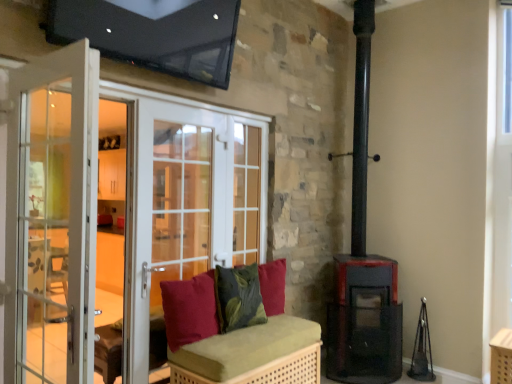
Locate an element on the screen. Image resolution: width=512 pixels, height=384 pixels. white glass screen door at center, positioned as the 1th screen door in back-to-front order is located at coordinates (192, 204).

What do you see at coordinates (52, 218) in the screenshot?
I see `white glass screen door at left, the first screen door in the front-to-back sequence` at bounding box center [52, 218].

This screenshot has width=512, height=384. In order to click on matte black stove at lower right in this screenshot , I will do `click(364, 322)`.

Relative to white glass screen door at left, which is counted as the 2th screen door, starting from the back, is green textured cushion at center, which is the second pillow from front to back, in front or behind?

green textured cushion at center, which is the second pillow from front to back, is positioned farther from the viewer than white glass screen door at left, which is counted as the 2th screen door, starting from the back.

Does green textured cushion at center, which is the second pillow from front to back, have a lesser height compared to white glass screen door at left, the first screen door in the front-to-back sequence?

Yes, green textured cushion at center, which is the second pillow from front to back, is shorter than white glass screen door at left, the first screen door in the front-to-back sequence.

Can you confirm if green textured cushion at center, which is the second pillow from front to back, is smaller than white glass screen door at left, the first screen door in the front-to-back sequence?

A: Yes, green textured cushion at center, which is the second pillow from front to back, is smaller than white glass screen door at left, the first screen door in the front-to-back sequence.

From the image's perspective, is velvet red cushion at center, the first pillow positioned from the front, located above green woven bench at center?

Indeed, from the image's perspective, velvet red cushion at center, the first pillow positioned from the front, is shown above green woven bench at center.

Image resolution: width=512 pixels, height=384 pixels. In the image, there is a velvet red cushion at center, the first pillow positioned from the front. Identify the location of furniture below it (from a real-world perspective). (231, 332).

Would you say velvet red cushion at center, the first pillow positioned from the front, is outside green woven bench at center?

Yes, velvet red cushion at center, the first pillow positioned from the front, is outside of green woven bench at center.

Is velvet red cushion at center, which ranks as the 3th pillow in back-to-front order, in contact with green woven bench at center?

velvet red cushion at center, which ranks as the 3th pillow in back-to-front order, and green woven bench at center are clearly separated.

Identify the location of stove lying above the green woven bench at center (from the image's perspective). This screenshot has height=384, width=512. (364, 322).

Which of these two, green woven bench at center or matte black stove at lower right, stands taller?

Standing taller between the two is matte black stove at lower right.

Looking at this image, who is bigger, green woven bench at center or matte black stove at lower right?

With larger size is green woven bench at center.

From the image's perspective, which one is positioned higher, green woven bench at center or matte black stove at lower right?

matte black stove at lower right appears higher in the image.

How different are the orientations of green textured cushion at center, which ranks as the second pillow in back-to-front order, and velvet red cushion at center, which ranks as the 3th pillow in back-to-front order, in degrees?

0.00187 degrees separate the facing orientations of green textured cushion at center, which ranks as the second pillow in back-to-front order, and velvet red cushion at center, which ranks as the 3th pillow in back-to-front order.

Considering the positions of point (256, 273) and point (209, 316), is point (256, 273) closer or farther from the camera than point (209, 316)?

Point (256, 273) is farther from the camera than point (209, 316).

Can you confirm if green textured cushion at center, which is the second pillow from front to back, is positioned to the right of velvet red cushion at center, the first pillow positioned from the front?

Indeed, green textured cushion at center, which is the second pillow from front to back, is positioned on the right side of velvet red cushion at center, the first pillow positioned from the front.

Considering the relative sizes of green textured cushion at center, which ranks as the second pillow in back-to-front order, and velvet red cushion at center, which ranks as the 3th pillow in back-to-front order, in the image provided, is green textured cushion at center, which ranks as the second pillow in back-to-front order, taller than velvet red cushion at center, which ranks as the 3th pillow in back-to-front order,?

No, green textured cushion at center, which ranks as the second pillow in back-to-front order, is not taller than velvet red cushion at center, which ranks as the 3th pillow in back-to-front order.

Identify the location of screen door that appears below the white glass screen door at left, which is counted as the 2th screen door, starting from the back (from a real-world perspective). Image resolution: width=512 pixels, height=384 pixels. pos(192,204).

Would you say white glass screen door at left, which is counted as the 2th screen door, starting from the back, is outside white glass screen door at center, positioned as the 1th screen door in back-to-front order?

Absolutely, white glass screen door at left, which is counted as the 2th screen door, starting from the back, is external to white glass screen door at center, positioned as the 1th screen door in back-to-front order.

How much distance is there between white glass screen door at left, which is counted as the 2th screen door, starting from the back, and white glass screen door at center, positioned as the 1th screen door in back-to-front order?

A distance of 98.73 centimeters exists between white glass screen door at left, which is counted as the 2th screen door, starting from the back, and white glass screen door at center, positioned as the 1th screen door in back-to-front order.

Is white glass screen door at center, positioned as the 1th screen door in back-to-front order, not near green textured cushion at center, which is the second pillow from front to back?

No, there isn't a large distance between white glass screen door at center, positioned as the 1th screen door in back-to-front order, and green textured cushion at center, which is the second pillow from front to back.

Which of these two, white glass screen door at center, positioned as the 1th screen door in back-to-front order, or green textured cushion at center, which is the second pillow from front to back, is bigger?

white glass screen door at center, positioned as the 1th screen door in back-to-front order.

Is white glass screen door at center, which ranks as the second screen door in front-to-back order, facing away from green textured cushion at center, which ranks as the second pillow in back-to-front order?

white glass screen door at center, which ranks as the second screen door in front-to-back order, does not have its back to green textured cushion at center, which ranks as the second pillow in back-to-front order.

Relative to green textured cushion at center, which is the second pillow from front to back, is white glass screen door at center, which ranks as the second screen door in front-to-back order, in front or behind?

Clearly, white glass screen door at center, which ranks as the second screen door in front-to-back order, is in front of green textured cushion at center, which is the second pillow from front to back.

Is matte black stove at lower right with white glass screen door at left, which is counted as the 2th screen door, starting from the back?

They are not placed beside each other.

Is matte black stove at lower right closer to the viewer compared to white glass screen door at left, which is counted as the 2th screen door, starting from the back?

No, it is behind white glass screen door at left, which is counted as the 2th screen door, starting from the back.

Is matte black stove at lower right wider or thinner than white glass screen door at left, the first screen door in the front-to-back sequence?

Clearly, matte black stove at lower right has more width compared to white glass screen door at left, the first screen door in the front-to-back sequence.

Between matte black stove at lower right and white glass screen door at left, the first screen door in the front-to-back sequence, which one appears on the left side from the viewer's perspective?

white glass screen door at left, the first screen door in the front-to-back sequence.

Find the location of a particular element. This screenshot has height=384, width=512. pillow that is the 2nd one when counting backward from the white glass screen door at left, the first screen door in the front-to-back sequence is located at coordinates (238, 297).

Find the location of a particular element. The width and height of the screenshot is (512, 384). furniture below the velvet red cushion at center, which ranks as the 3th pillow in back-to-front order (from the image's perspective) is located at coordinates (231, 332).

Based on their spatial positions, is green textured cushion at center, which ranks as the second pillow in back-to-front order, or velvet red cushion at center, positioned as the third pillow in front-to-back order, closer to velvet red cushion at center, the first pillow positioned from the front?

green textured cushion at center, which ranks as the second pillow in back-to-front order, is positioned closer to the anchor velvet red cushion at center, the first pillow positioned from the front.

Considering their positions, is velvet red cushion at center, the first pillow positioned from the front, positioned closer to green woven bench at center than matte black stove at lower right?

The object closer to green woven bench at center is velvet red cushion at center, the first pillow positioned from the front.

When comparing their distances from green woven bench at center, does white glass screen door at center, positioned as the 1th screen door in back-to-front order, or velvet red cushion at center, the first pillow positioned from the front, seem further?

Based on the image, white glass screen door at center, positioned as the 1th screen door in back-to-front order, appears to be further to green woven bench at center.

Based on their spatial positions, is green textured cushion at center, which ranks as the second pillow in back-to-front order, or green woven bench at center further from white glass screen door at center, positioned as the 1th screen door in back-to-front order?

Based on the image, green textured cushion at center, which ranks as the second pillow in back-to-front order, appears to be further to white glass screen door at center, positioned as the 1th screen door in back-to-front order.

Based on their spatial positions, is velvet red cushion at center, which ranks as the 3th pillow in back-to-front order, or green woven bench at center further from green textured cushion at center, which ranks as the second pillow in back-to-front order?

velvet red cushion at center, which ranks as the 3th pillow in back-to-front order, lies further to green textured cushion at center, which ranks as the second pillow in back-to-front order, than the other object.

When comparing their distances from velvet red cushion at center, positioned as the third pillow in front-to-back order, does matte black stove at lower right or velvet red cushion at center, the first pillow positioned from the front, seem further?

matte black stove at lower right is further to velvet red cushion at center, positioned as the third pillow in front-to-back order.

Based on their spatial positions, is white glass screen door at left, the first screen door in the front-to-back sequence, or white glass screen door at center, positioned as the 1th screen door in back-to-front order, closer to green woven bench at center?

Based on the image, white glass screen door at center, positioned as the 1th screen door in back-to-front order, appears to be nearer to green woven bench at center.

Considering their positions, is white glass screen door at center, positioned as the 1th screen door in back-to-front order, positioned closer to velvet red cushion at center, which ranks as the 3th pillow in back-to-front order, than matte black stove at lower right?

Based on the image, white glass screen door at center, positioned as the 1th screen door in back-to-front order, appears to be nearer to velvet red cushion at center, which ranks as the 3th pillow in back-to-front order.

In order to click on screen door situated between white glass screen door at left, which is counted as the 2th screen door, starting from the back, and matte black stove at lower right from left to right in this screenshot , I will do `click(192, 204)`.

Find the location of a particular element. Image resolution: width=512 pixels, height=384 pixels. furniture between white glass screen door at left, which is counted as the 2th screen door, starting from the back, and velvet red cushion at center, which ranks as the 3th pillow in back-to-front order, from front to back is located at coordinates (231, 332).

Where is `furniture between white glass screen door at left, the first screen door in the front-to-back sequence, and green textured cushion at center, which is the second pillow from front to back, from front to back`? The image size is (512, 384). furniture between white glass screen door at left, the first screen door in the front-to-back sequence, and green textured cushion at center, which is the second pillow from front to back, from front to back is located at coordinates (231, 332).

Find the location of `furniture between velvet red cushion at center, the first pillow positioned from the front, and matte black stove at lower right, in the horizontal direction`. furniture between velvet red cushion at center, the first pillow positioned from the front, and matte black stove at lower right, in the horizontal direction is located at coordinates (231, 332).